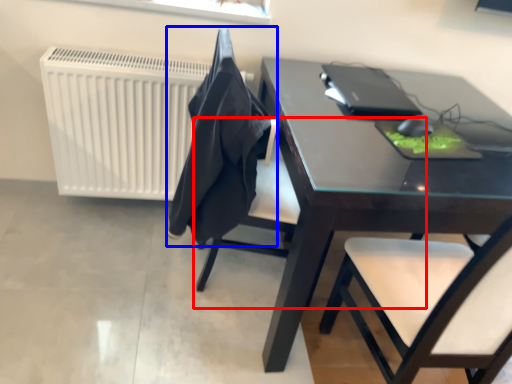
Question: Which object is closer to the camera taking this photo, chair (highlighted by a red box) or cloth (highlighted by a blue box)?

Choices:
 (A) chair
 (B) cloth

Answer: (B)